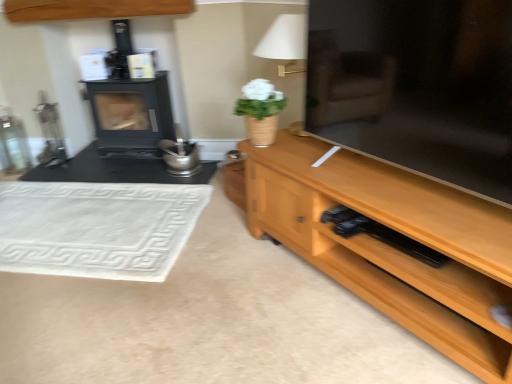
Question: Is wooden cabinet at upper center in front of wooden tv stand at right?

Choices:
 (A) no
 (B) yes

Answer: (A)

Question: From a real-world perspective, is wooden cabinet at upper center located beneath wooden tv stand at right?

Choices:
 (A) no
 (B) yes

Answer: (A)

Question: Is wooden cabinet at upper center facing towards wooden tv stand at right?

Choices:
 (A) yes
 (B) no

Answer: (B)

Question: From a real-world perspective, is wooden cabinet at upper center positioned over wooden tv stand at right based on gravity?

Choices:
 (A) yes
 (B) no

Answer: (A)

Question: Is wooden tv stand at right inside wooden cabinet at upper center?

Choices:
 (A) no
 (B) yes

Answer: (A)

Question: Can you confirm if wooden cabinet at upper center is wider than wooden tv stand at right?

Choices:
 (A) yes
 (B) no

Answer: (B)

Question: Can you confirm if wooden cabinet at upper center is thinner than black matte wood burning stove at left?

Choices:
 (A) no
 (B) yes

Answer: (B)

Question: Is wooden cabinet at upper center to the right of black matte wood burning stove at left from the viewer's perspective?

Choices:
 (A) no
 (B) yes

Answer: (A)

Question: From the image's perspective, is wooden cabinet at upper center over black matte wood burning stove at left?

Choices:
 (A) no
 (B) yes

Answer: (B)

Question: Is black matte wood burning stove at left surrounded by wooden cabinet at upper center?

Choices:
 (A) yes
 (B) no

Answer: (B)

Question: Is wooden cabinet at upper center further to camera compared to black matte wood burning stove at left?

Choices:
 (A) yes
 (B) no

Answer: (B)

Question: Is wooden cabinet at upper center located outside black matte wood burning stove at left?

Choices:
 (A) yes
 (B) no

Answer: (A)

Question: Is white fabric lampshade at upper center positioned behind wooden cabinet at upper center?

Choices:
 (A) no
 (B) yes

Answer: (A)